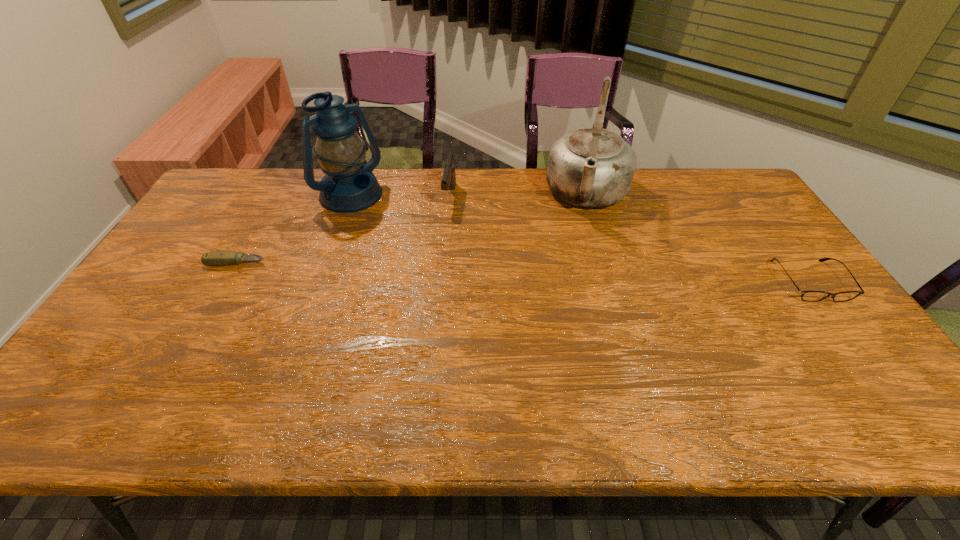
Locate an element on the screen. the shortest object is located at coordinates (218, 258).

Where is `pocketknife`? The height and width of the screenshot is (540, 960). pocketknife is located at coordinates (218, 258).

Where is `spectacles`? The width and height of the screenshot is (960, 540). spectacles is located at coordinates (810, 296).

At what (x,y) coordinates should I click in order to perform the action: click on the second shortest object. Please return your answer as a coordinate pair (x, y). Image resolution: width=960 pixels, height=540 pixels. Looking at the image, I should click on (810, 296).

The width and height of the screenshot is (960, 540). What are the coordinates of `kettle` in the screenshot? It's located at (593, 167).

Locate an element on the screen. the third object from left to right is located at coordinates (448, 182).

Identify the location of the third tallest object. (448, 182).

This screenshot has width=960, height=540. Identify the location of lantern. (349, 185).

At what (x,y) coordinates should I click in order to perform the action: click on vacant space located 0.270m on the right of the leftmost object. Please return your answer as a coordinate pair (x, y). This screenshot has width=960, height=540. Looking at the image, I should click on (360, 262).

Where is `free space located on the front-facing side of the spectacles`? The width and height of the screenshot is (960, 540). free space located on the front-facing side of the spectacles is located at coordinates (843, 325).